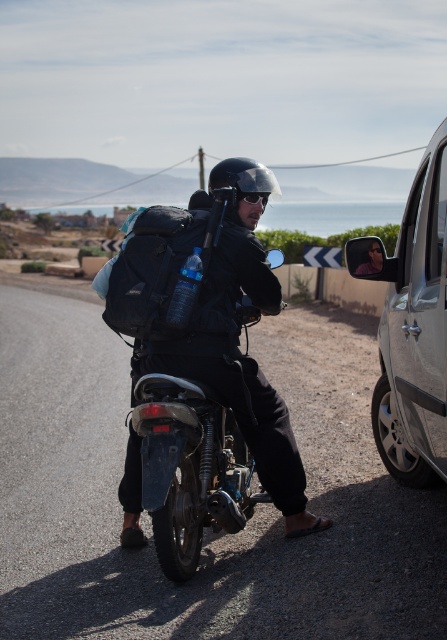
Is black fabric backpack at center thinner than sunglasses at center?

No.

Can you confirm if black fabric backpack at center is shorter than sunglasses at center?

No.

Image resolution: width=447 pixels, height=640 pixels. What do you see at coordinates (164, 275) in the screenshot? I see `black fabric backpack at center` at bounding box center [164, 275].

At what (x,y) coordinates should I click in order to perform the action: click on black fabric backpack at center. Please return your answer as a coordinate pair (x, y). Looking at the image, I should click on (164, 275).

Can you confirm if silver metallic car at right is wider than sunglasses at center?

Incorrect, silver metallic car at right's width does not surpass sunglasses at center's.

Is point (391, 273) behind point (261, 198)?

No.

Where is `silver metallic car at right`? silver metallic car at right is located at coordinates (412, 326).

Find the location of `silver metallic car at right`. silver metallic car at right is located at coordinates (412, 326).

Can you confirm if matte black motorcycle at center is thinner than black matte helmet at center?

No, matte black motorcycle at center is not thinner than black matte helmet at center.

Based on the photo, between matte black motorcycle at center and black matte helmet at center, which one is positioned lower?

matte black motorcycle at center

Is point (223, 518) in front of point (241, 172)?

Yes, it is.

The image size is (447, 640). I want to click on matte black motorcycle at center, so click(x=189, y=467).